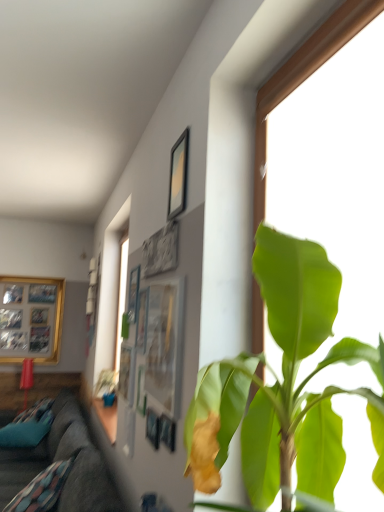
Question: Is matte black picture frame at upper center, marked as the fourth picture frame in a back-to-front arrangement, at the left side of wooden photo frame at left, the 1th picture frame viewed from the left?

Choices:
 (A) yes
 (B) no

Answer: (B)

Question: Is matte black picture frame at upper center, which is counted as the second picture frame, starting from the front, facing towards wooden photo frame at left, which appears as the 5th picture frame when viewed from the front?

Choices:
 (A) yes
 (B) no

Answer: (B)

Question: Is matte black picture frame at upper center, which is counted as the fifth picture frame, starting from the left, taller than wooden photo frame at left, the 1th picture frame viewed from the left?

Choices:
 (A) no
 (B) yes

Answer: (A)

Question: Does matte black picture frame at upper center, marked as the fourth picture frame in a back-to-front arrangement, have a larger size compared to wooden photo frame at left, the 1th picture frame viewed from the left?

Choices:
 (A) yes
 (B) no

Answer: (B)

Question: Does matte black picture frame at upper center, marked as the fourth picture frame in a back-to-front arrangement, have a greater width compared to wooden photo frame at left, which appears as the 5th picture frame when viewed from the front?

Choices:
 (A) yes
 (B) no

Answer: (B)

Question: Is green leafy plant at center bigger or smaller than matte glass picture frame at center, the fourth picture frame when ordered from left to right?

Choices:
 (A) small
 (B) big

Answer: (B)

Question: Considering the positions of green leafy plant at center and matte glass picture frame at center, the fourth picture frame when ordered from left to right, in the image, is green leafy plant at center wider or thinner than matte glass picture frame at center, the fourth picture frame when ordered from left to right,?

Choices:
 (A) wide
 (B) thin

Answer: (A)

Question: From the image's perspective, relative to matte glass picture frame at center, positioned as the 1th picture frame in front-to-back order, is green leafy plant at center above or below?

Choices:
 (A) below
 (B) above

Answer: (B)

Question: Considering their positions, is green leafy plant at center located in front of or behind matte glass picture frame at center, the fourth picture frame when ordered from left to right?

Choices:
 (A) front
 (B) behind

Answer: (A)

Question: In the image, is matte black picture frame at upper center, which is counted as the fifth picture frame, starting from the left, on the left side or the right side of wooden photo frame at left, which is the 1th picture frame in back-to-front order?

Choices:
 (A) right
 (B) left

Answer: (A)

Question: In terms of width, does matte black picture frame at upper center, which is counted as the second picture frame, starting from the front, look wider or thinner when compared to wooden photo frame at left, which ranks as the fifth picture frame in right-to-left order?

Choices:
 (A) thin
 (B) wide

Answer: (A)

Question: From a real-world perspective, is matte black picture frame at upper center, which is counted as the second picture frame, starting from the front, physically located above or below wooden photo frame at left, the 1th picture frame viewed from the left?

Choices:
 (A) below
 (B) above

Answer: (B)

Question: Which is correct: matte black picture frame at upper center, marked as the fourth picture frame in a back-to-front arrangement, is inside wooden photo frame at left, which ranks as the fifth picture frame in right-to-left order, or outside of it?

Choices:
 (A) outside
 (B) inside

Answer: (A)

Question: Is matte black picture frame at upper center, which is counted as the fifth picture frame, starting from the left, taller or shorter than green leafy plant at center?

Choices:
 (A) tall
 (B) short

Answer: (B)

Question: Is matte black picture frame at upper center, which is counted as the second picture frame, starting from the front, wider or thinner than green leafy plant at center?

Choices:
 (A) wide
 (B) thin

Answer: (B)